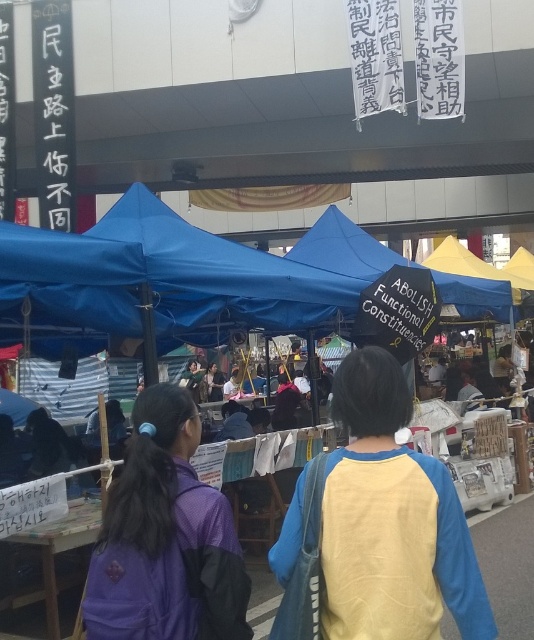
Question: Does yellow fabric shirt at center have a smaller size compared to purple fabric jacket at center?

Choices:
 (A) yes
 (B) no

Answer: (B)

Question: Which object appears farthest from the camera in this image?

Choices:
 (A) purple fabric jacket at center
 (B) yellow fabric shirt at center

Answer: (A)

Question: Is yellow fabric shirt at center further to camera compared to purple fabric jacket at center?

Choices:
 (A) yes
 (B) no

Answer: (B)

Question: Can you confirm if yellow fabric shirt at center is thinner than purple fabric jacket at center?

Choices:
 (A) yes
 (B) no

Answer: (B)